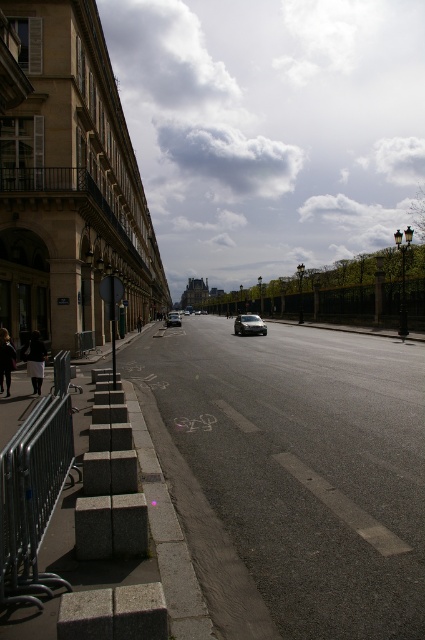
You are a delivery person needing to park a 15 feet long truck between the satin black car at center and the shiny silver sedan at center. Can you fit the truck in the space between them?

The satin black car at center and shiny silver sedan at center are 106.90 feet apart from each other. Since the truck is only 15 feet long, there is more than enough space to park the truck between them.

You are a delivery driver who needs to park your 4.5 meter long truck in this street. The truck requires a parking space of at least 5 meters. You see the satin black car at center and the shiny silver sedan at center. Which vehicle is more likely to indicate that there is enough space between them for your truck?

The shiny silver sedan at center is longer than the satin black car at center, so the space between them might be sufficient for the truck requiring 5 meters.

You are a delivery robot navigating the urban street scene. You need to place a package on the sidewalk near the silver metallic rail at lower left. Your current position is at point (33, 497). Is this point on the silver metallic rail at lower left?

Yes, the point (33, 497) is on the silver metallic rail at lower left, so you can safely place the package there.